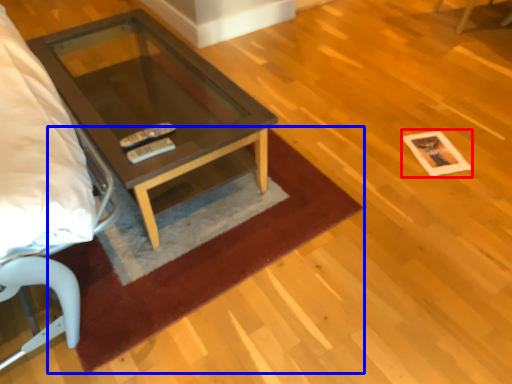
Question: Among these objects, which one is nearest to the camera, square (highlighted by a red box) or mat (highlighted by a blue box)?

Choices:
 (A) square
 (B) mat

Answer: (B)